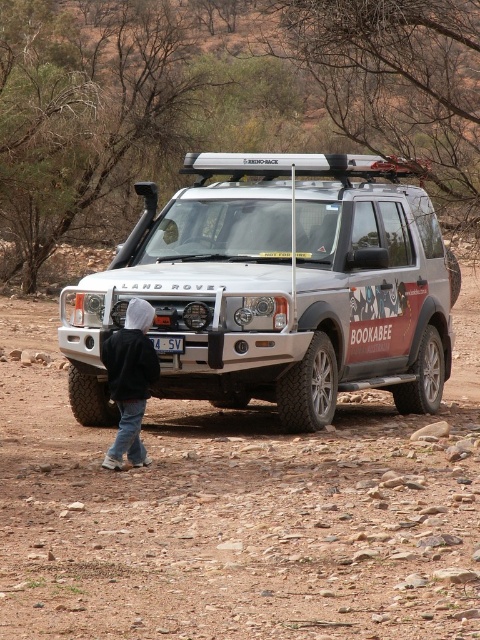
From the picture: You are a driver planning to park your car behind the Land Rover. The dirt track at center and the white plastic license plate at center are both visible. Which one should you avoid hitting to prevent damage to your car?

You should avoid hitting the dirt track at center because it is taller than the white plastic license plate at center, so it poses a higher risk of damaging your car.

Consider the image. You are standing at the center of the image. Which direction should you move to reach the black hoodie at lower left?

You should move to the lower left direction to reach the black hoodie at lower left.

You are a photographer trying to capture the silver metallic jeep at center and the white plastic license plate at center in a single frame. Considering their sizes, which object will appear bigger in the photo?

The silver metallic jeep at center will appear bigger in the photo because it has a larger size compared to the white plastic license plate at center.